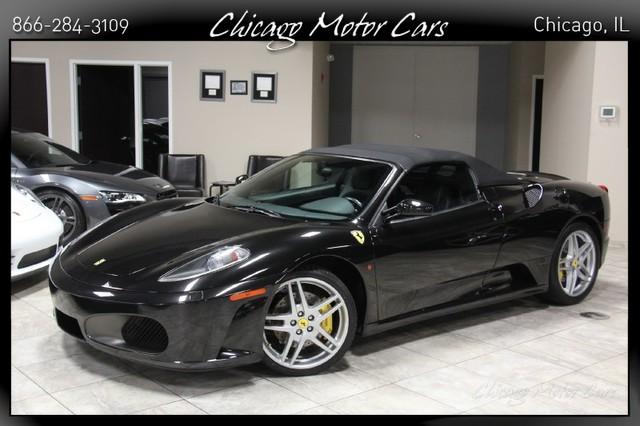
What are the coordinates of `floor` in the screenshot? It's located at (468, 367).